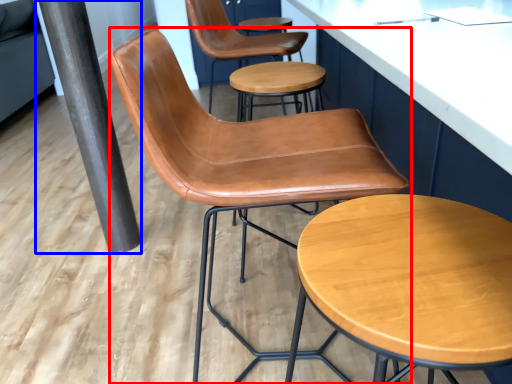
Question: Among these objects, which one is farthest to the camera, chair (highlighted by a red box) or beam (highlighted by a blue box)?

Choices:
 (A) chair
 (B) beam

Answer: (B)